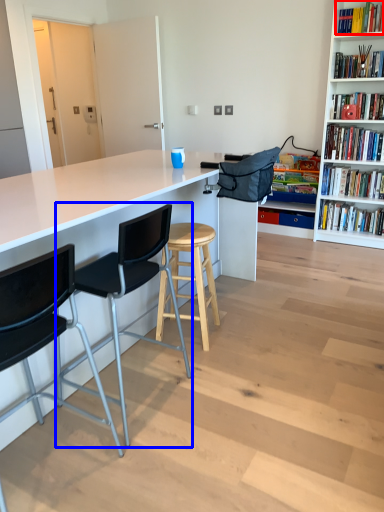
Question: Which object is closer to the camera taking this photo, book (highlighted by a red box) or chair (highlighted by a blue box)?

Choices:
 (A) book
 (B) chair

Answer: (B)